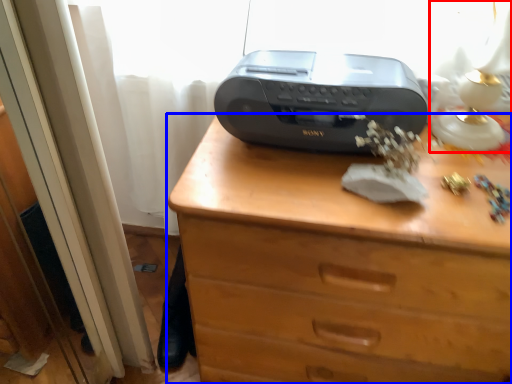
Question: Which object appears closest to the camera in this image, table lamp (highlighted by a red box) or chest of drawers (highlighted by a blue box)?

Choices:
 (A) table lamp
 (B) chest of drawers

Answer: (A)